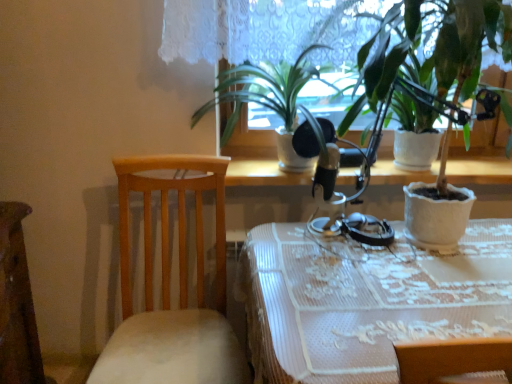
How much space does white textured pot at right, which appears as the 1th houseplant when viewed from the right, occupy horizontally?

50.84 centimeters.

In order to click on white lace tablecloth at center in this screenshot , I will do `click(366, 300)`.

At what (x,y) coordinates should I click in order to perform the action: click on green matte plant at center, which is counted as the 2th houseplant, starting from the right. Please return your answer as a coordinate pair (x, y). The width and height of the screenshot is (512, 384). Looking at the image, I should click on (266, 100).

At what (x,y) coordinates should I click in order to perform the action: click on white textured pot at right, which is the 2th houseplant from left to right. Please return your answer as a coordinate pair (x, y). This screenshot has height=384, width=512. Looking at the image, I should click on (468, 43).

Can you see wooden chair at left touching white textured pot at right, which is the 2th houseplant from left to right?

There is a gap between wooden chair at left and white textured pot at right, which is the 2th houseplant from left to right.

How different are the orientations of wooden chair at left and white textured pot at right, which is the 2th houseplant from left to right, in degrees?

The facing directions of wooden chair at left and white textured pot at right, which is the 2th houseplant from left to right, are 8.98 degrees apart.

Looking at the image, does wooden chair at left seem bigger or smaller compared to white textured pot at right, which appears as the 1th houseplant when viewed from the right?

wooden chair at left is bigger than white textured pot at right, which appears as the 1th houseplant when viewed from the right.

Which object is wider, wooden chair at left or white textured pot at right, which is the 2th houseplant from left to right?

Wider between the two is wooden chair at left.

Can you confirm if white lace tablecloth at center is wider than wooden chair at left?

Correct, the width of white lace tablecloth at center exceeds that of wooden chair at left.

From a real-world perspective, which is physically above, white lace tablecloth at center or wooden chair at left?

In real-world perspective, wooden chair at left is above.

Does white lace tablecloth at center have a greater height compared to wooden chair at left?

In fact, white lace tablecloth at center may be shorter than wooden chair at left.

Which is correct: white textured pot at right, which is the 2th houseplant from left to right, is inside green matte plant at center, acting as the first houseplant starting from the left, or outside of it?

white textured pot at right, which is the 2th houseplant from left to right, is not enclosed by green matte plant at center, acting as the first houseplant starting from the left.

Is white textured pot at right, which is the 2th houseplant from left to right, turned away from green matte plant at center, which is counted as the 2th houseplant, starting from the right?

No, green matte plant at center, which is counted as the 2th houseplant, starting from the right, is not at the back of white textured pot at right, which is the 2th houseplant from left to right.

Considering the positions of objects white textured pot at right, which is the 2th houseplant from left to right, and green matte plant at center, acting as the first houseplant starting from the left, in the image provided, who is more to the left, white textured pot at right, which is the 2th houseplant from left to right, or green matte plant at center, acting as the first houseplant starting from the left,?

From the viewer's perspective, green matte plant at center, acting as the first houseplant starting from the left, appears more on the left side.

Looking at this image, how many degrees apart are the facing directions of white textured pot at right, which appears as the 1th houseplant when viewed from the right, and green matte plant at center, acting as the first houseplant starting from the left?

5.21 degrees separate the facing orientations of white textured pot at right, which appears as the 1th houseplant when viewed from the right, and green matte plant at center, acting as the first houseplant starting from the left.

Where is `chair that is in front of the green matte plant at center, which is counted as the 2th houseplant, starting from the right`? chair that is in front of the green matte plant at center, which is counted as the 2th houseplant, starting from the right is located at coordinates point(169,286).

In terms of height, does green matte plant at center, acting as the first houseplant starting from the left, look taller or shorter compared to wooden chair at left?

In the image, green matte plant at center, acting as the first houseplant starting from the left, appears to be shorter than wooden chair at left.

From a real-world perspective, does green matte plant at center, which is counted as the 2th houseplant, starting from the right, stand above wooden chair at left?

Yes, from a real-world perspective, green matte plant at center, which is counted as the 2th houseplant, starting from the right, is over wooden chair at left

Is green matte plant at center, acting as the first houseplant starting from the left, next to wooden chair at left?

No, green matte plant at center, acting as the first houseplant starting from the left, is not with wooden chair at left.

Is wooden chair at left to the left of white lace tablecloth at center from the viewer's perspective?

→ Yes.

Is point (142, 190) closer or farther from the camera than point (289, 359)?

Clearly, point (142, 190) is more distant from the camera than point (289, 359).

Which of these two, wooden chair at left or white lace tablecloth at center, stands shorter?

white lace tablecloth at center.

Does wooden chair at left contain white lace tablecloth at center?

No, white lace tablecloth at center is not a part of wooden chair at left.

Does green matte plant at center, acting as the first houseplant starting from the left, have a lesser height compared to white lace tablecloth at center?

Correct, green matte plant at center, acting as the first houseplant starting from the left, is not as tall as white lace tablecloth at center.

Is green matte plant at center, acting as the first houseplant starting from the left, positioned beyond the bounds of white lace tablecloth at center?

Yes, green matte plant at center, acting as the first houseplant starting from the left, is not within white lace tablecloth at center.

Is green matte plant at center, acting as the first houseplant starting from the left, positioned behind white lace tablecloth at center?

Yes, green matte plant at center, acting as the first houseplant starting from the left, is further from the viewer.

Between point (294, 81) and point (281, 328), which one is positioned in front?

The point (281, 328) is more forward.

Based on the photo, which is less distant, (510, 15) or (243, 354)?

The point (510, 15) is more forward.

Considering the positions of objects white textured pot at right, which appears as the 1th houseplant when viewed from the right, and wooden chair at left in the image provided, who is behind, white textured pot at right, which appears as the 1th houseplant when viewed from the right, or wooden chair at left?

wooden chair at left is further away from the camera.

How different are the orientations of white textured pot at right, which appears as the 1th houseplant when viewed from the right, and wooden chair at left in degrees?

The angular difference between white textured pot at right, which appears as the 1th houseplant when viewed from the right, and wooden chair at left is 8.98 degrees.

Between white textured pot at right, which appears as the 1th houseplant when viewed from the right, and wooden chair at left, which one appears on the right side from the viewer's perspective?

From the viewer's perspective, white textured pot at right, which appears as the 1th houseplant when viewed from the right, appears more on the right side.

Starting from the wooden chair at left, which houseplant is the 2nd one to the right? Please provide its 2D coordinates.

[(468, 43)]

What are the coordinates of `chair above the white lace tablecloth at center (from the image's perspective)` in the screenshot? It's located at (169, 286).

Considering their positions, is white lace tablecloth at center positioned further to white textured pot at right, which is the 2th houseplant from left to right, than wooden chair at left?

wooden chair at left lies further to white textured pot at right, which is the 2th houseplant from left to right, than the other object.

Which object lies further to the anchor point green matte plant at center, which is counted as the 2th houseplant, starting from the right, white textured pot at right, which is the 2th houseplant from left to right, or white lace tablecloth at center?

white lace tablecloth at center is further to green matte plant at center, which is counted as the 2th houseplant, starting from the right.

Looking at the image, which one is located further to white textured pot at right, which appears as the 1th houseplant when viewed from the right, wooden chair at left or white lace tablecloth at center?

The object further to white textured pot at right, which appears as the 1th houseplant when viewed from the right, is wooden chair at left.

Estimate the real-world distances between objects in this image. Which object is further from wooden chair at left, white textured pot at right, which appears as the 1th houseplant when viewed from the right, or white lace tablecloth at center?

white textured pot at right, which appears as the 1th houseplant when viewed from the right.

Based on their spatial positions, is wooden chair at left or white textured pot at right, which appears as the 1th houseplant when viewed from the right, closer to white lace tablecloth at center?

wooden chair at left.

Considering their positions, is green matte plant at center, acting as the first houseplant starting from the left, positioned closer to wooden chair at left than white lace tablecloth at center?

green matte plant at center, acting as the first houseplant starting from the left, is positioned closer to the anchor wooden chair at left.

From the image, which object appears to be nearer to green matte plant at center, which is counted as the 2th houseplant, starting from the right, wooden chair at left or white lace tablecloth at center?

The object closer to green matte plant at center, which is counted as the 2th houseplant, starting from the right, is wooden chair at left.

Looking at the image, which one is located further to wooden chair at left, white textured pot at right, which appears as the 1th houseplant when viewed from the right, or green matte plant at center, acting as the first houseplant starting from the left?

white textured pot at right, which appears as the 1th houseplant when viewed from the right, is further to wooden chair at left.

The width and height of the screenshot is (512, 384). I want to click on chair between green matte plant at center, acting as the first houseplant starting from the left, and white lace tablecloth at center in the up-down direction, so click(x=169, y=286).

At what (x,y) coordinates should I click in order to perform the action: click on houseplant between green matte plant at center, acting as the first houseplant starting from the left, and white lace tablecloth at center, in the vertical direction. Please return your answer as a coordinate pair (x, y). Image resolution: width=512 pixels, height=384 pixels. Looking at the image, I should click on pyautogui.click(x=468, y=43).

The width and height of the screenshot is (512, 384). I want to click on table between wooden chair at left and white textured pot at right, which appears as the 1th houseplant when viewed from the right, in the horizontal direction, so click(x=366, y=300).

Locate an element on the screen. houseplant between wooden chair at left and white textured pot at right, which is the 2th houseplant from left to right, in the horizontal direction is located at coordinates (266, 100).